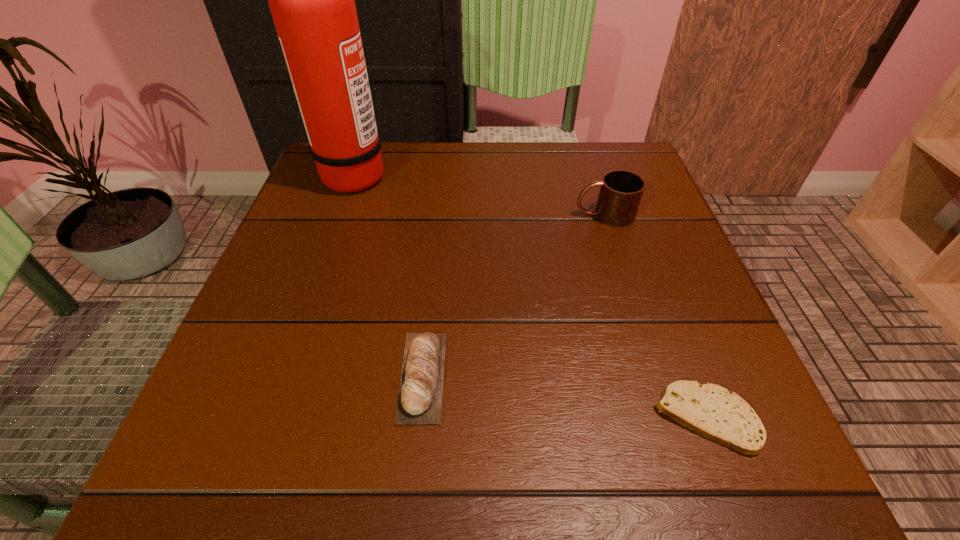
At what (x,y) coordinates should I click in order to perform the action: click on free location that satisfies the following two spatial constraints: 1. on the handle side of the fire extinguisher; 2. on the right side of the left pita bread. Please return your answer as a coordinate pair (x, y). Image resolution: width=960 pixels, height=540 pixels. Looking at the image, I should click on (284, 376).

The image size is (960, 540). Find the location of `blank space that satisfies the following two spatial constraints: 1. on the handle side of the leftmost object; 2. on the back side of the shortest object`. blank space that satisfies the following two spatial constraints: 1. on the handle side of the leftmost object; 2. on the back side of the shortest object is located at coordinates (270, 417).

This screenshot has height=540, width=960. I want to click on blank area in the image that satisfies the following two spatial constraints: 1. on the side of the mug with the handle; 2. on the left side of the shorter pita bread, so click(x=668, y=417).

Find the location of a particular element. This screenshot has height=540, width=960. free space that satisfies the following two spatial constraints: 1. on the side of the second tallest object with the handle; 2. on the back side of the shorter pita bread is located at coordinates (668, 417).

The width and height of the screenshot is (960, 540). In order to click on vacant point that satisfies the following two spatial constraints: 1. on the front side of the taller pita bread; 2. on the left side of the shortest object in this screenshot , I will do `click(418, 417)`.

Find the location of a particular element. blank area in the image that satisfies the following two spatial constraints: 1. on the handle side of the leftmost object; 2. on the right side of the right pita bread is located at coordinates (270, 417).